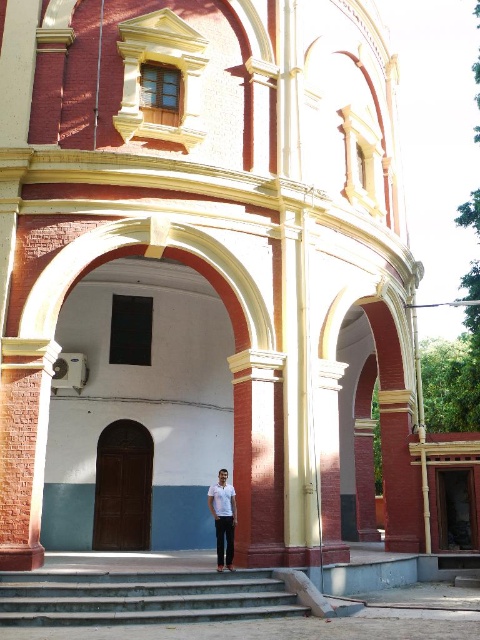
Question: Can you confirm if concrete stairs at center is bigger than white matte shirt at center?

Choices:
 (A) yes
 (B) no

Answer: (A)

Question: Which point is closer to the camera?

Choices:
 (A) (217, 600)
 (B) (231, 506)

Answer: (A)

Question: Is concrete stairs at center thinner than white matte shirt at center?

Choices:
 (A) no
 (B) yes

Answer: (A)

Question: Can you confirm if concrete stairs at center is positioned below white matte shirt at center?

Choices:
 (A) no
 (B) yes

Answer: (B)